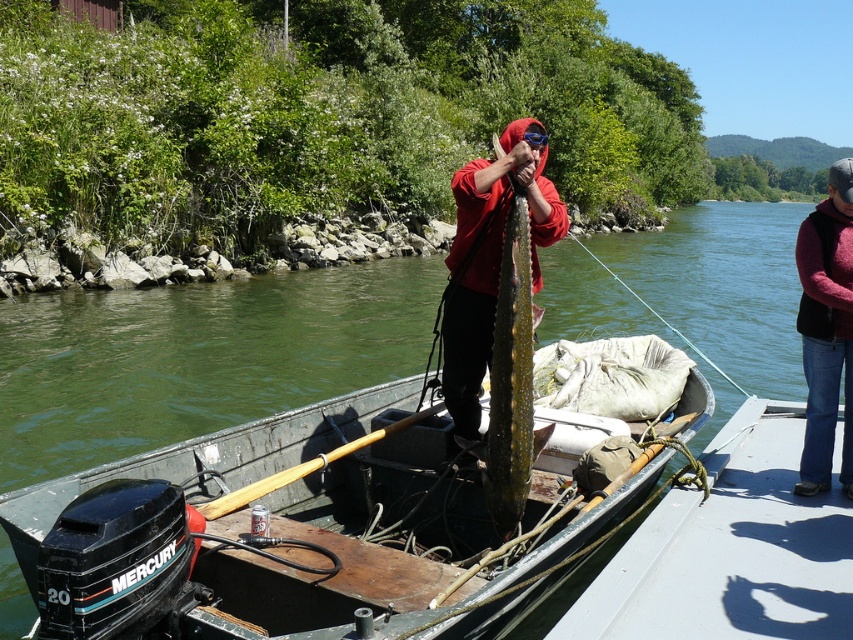
Question: Does maroon sweater at right appear over greenish-yellow textured fish at center?

Choices:
 (A) yes
 (B) no

Answer: (B)

Question: Which object is positioned closest to the maroon sweater at right?

Choices:
 (A) matte red hoodie at center
 (B) greenish-yellow textured fish at center

Answer: (A)

Question: Which of the following is the closest to the observer?

Choices:
 (A) (468, 305)
 (B) (825, 408)
 (C) (508, 330)
 (D) (207, 636)

Answer: (D)

Question: Which is farther from the greenish-yellow textured fish at center?

Choices:
 (A) wooden boat at center
 (B) maroon sweater at right

Answer: (B)

Question: Can you confirm if wooden boat at center is bigger than matte red hoodie at center?

Choices:
 (A) no
 (B) yes

Answer: (B)

Question: Can you confirm if maroon sweater at right is bigger than greenish-yellow textured fish at center?

Choices:
 (A) yes
 (B) no

Answer: (A)